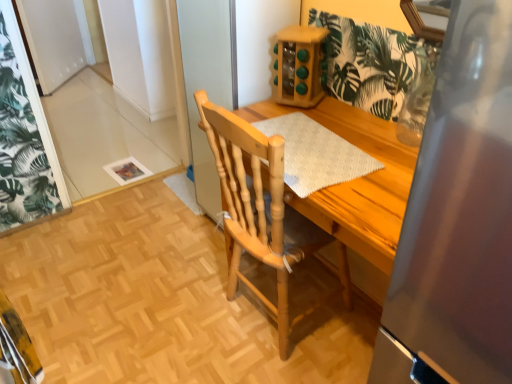
Locate an element on the screen. The height and width of the screenshot is (384, 512). natural wood chair at center is located at coordinates (251, 204).

Image resolution: width=512 pixels, height=384 pixels. Describe the element at coordinates (251, 204) in the screenshot. I see `natural wood chair at center` at that location.

The height and width of the screenshot is (384, 512). What are the coordinates of `white textured placemat at center` in the screenshot? It's located at (316, 154).

Describe the element at coordinates (316, 154) in the screenshot. This screenshot has height=384, width=512. I see `white textured placemat at center` at that location.

Find the location of a particular element. This screenshot has width=512, height=384. natural wood chair at center is located at coordinates (251, 204).

Which is more to the left, white textured placemat at center or natural wood chair at center?

natural wood chair at center.

Considering the positions of objects white textured placemat at center and natural wood chair at center in the image provided, who is in front, white textured placemat at center or natural wood chair at center?

natural wood chair at center is more forward.

Is point (320, 152) behind point (263, 297)?

No.

From the image's perspective, which object appears higher, white textured placemat at center or natural wood chair at center?

white textured placemat at center, from the image's perspective.

From a real-world perspective, is white textured placemat at center on natural wood chair at center?

Yes, from a real-world perspective, white textured placemat at center is above natural wood chair at center.

Which of these two, white textured placemat at center or natural wood chair at center, is thinner?

white textured placemat at center is thinner.

Who is taller, white textured placemat at center or natural wood chair at center?

Standing taller between the two is natural wood chair at center.

From the picture: Is white textured placemat at center smaller than natural wood chair at center?

Yes, white textured placemat at center is smaller than natural wood chair at center.

Is white textured placemat at center not inside natural wood chair at center?

No, white textured placemat at center is not outside of natural wood chair at center.

Is white textured placemat at center next to natural wood chair at center?

white textured placemat at center and natural wood chair at center are clearly separated.

Is white textured placemat at center positioned with its back to natural wood chair at center?

That's right, white textured placemat at center is facing away from natural wood chair at center.

How distant is white textured placemat at center from natural wood chair at center?

white textured placemat at center is 9.65 inches from natural wood chair at center.

Where is `chair lying on the left of white textured placemat at center`? chair lying on the left of white textured placemat at center is located at coordinates (251, 204).

Can you confirm if natural wood chair at center is positioned to the left of white textured placemat at center?

Correct, you'll find natural wood chair at center to the left of white textured placemat at center.

Is natural wood chair at center in front of or behind white textured placemat at center in the image?

Visually, natural wood chair at center is located in front of white textured placemat at center.

Between point (258, 221) and point (347, 144), which one is positioned behind?

The point (258, 221) is farther from the camera.

From the image's perspective, which one is positioned higher, natural wood chair at center or white textured placemat at center?

white textured placemat at center.

From a real-world perspective, is natural wood chair at center above or below white textured placemat at center?

natural wood chair at center is situated lower than white textured placemat at center in the real world.

Does natural wood chair at center have a greater width compared to white textured placemat at center?

Indeed, natural wood chair at center has a greater width compared to white textured placemat at center.

From their relative heights in the image, would you say natural wood chair at center is taller or shorter than white textured placemat at center?

In the image, natural wood chair at center appears to be taller than white textured placemat at center.

Based on their sizes in the image, would you say natural wood chair at center is bigger or smaller than white textured placemat at center?

natural wood chair at center is bigger than white textured placemat at center.

Could white textured placemat at center be considered to be inside natural wood chair at center?

Yes, white textured placemat at center is a part of natural wood chair at center.

Is natural wood chair at center next to white textured placemat at center and touching it?

No, natural wood chair at center is not touching white textured placemat at center.

Is natural wood chair at center positioned with its back to white textured placemat at center?

Yes, natural wood chair at center is facing away from white textured placemat at center.

Can you tell me how much natural wood chair at center and white textured placemat at center differ in facing direction?

There is a 177-degree angle between the facing directions of natural wood chair at center and white textured placemat at center.

Find the location of a particular element. The height and width of the screenshot is (384, 512). chair lying in front of the white textured placemat at center is located at coordinates (251, 204).

The image size is (512, 384). Find the location of `chair that appears below the white textured placemat at center (from a real-world perspective)`. chair that appears below the white textured placemat at center (from a real-world perspective) is located at coordinates (251, 204).

Identify the location of chair below the white textured placemat at center (from the image's perspective). The height and width of the screenshot is (384, 512). (251, 204).